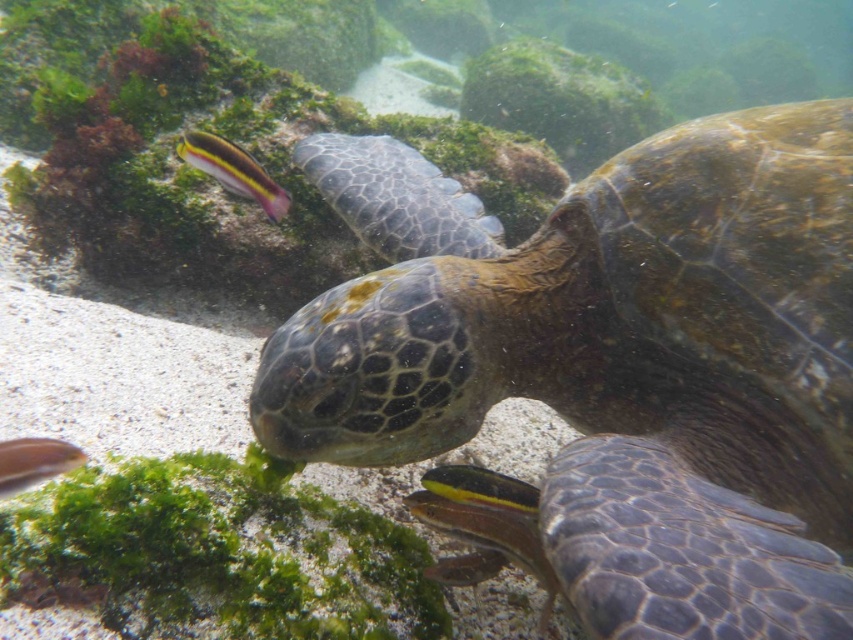
Does yellow-green striped fish at upper left have a greater height compared to shiny silver fish at lower left?

Correct, yellow-green striped fish at upper left is much taller as shiny silver fish at lower left.

Is point (180, 156) farther from viewer compared to point (77, 460)?

Yes, point (180, 156) is farther from viewer.

At what (x,y) coordinates should I click in order to perform the action: click on yellow-green striped fish at upper left. Please return your answer as a coordinate pair (x, y). This screenshot has width=853, height=640. Looking at the image, I should click on (233, 170).

In order to click on yellow-green striped fish at upper left in this screenshot , I will do `click(233, 170)`.

Does leathery green turtle at center appear on the right side of shiny silver fish at lower left?

Indeed, leathery green turtle at center is positioned on the right side of shiny silver fish at lower left.

Is point (602, 550) positioned after point (62, 470)?

That is False.

Between point (604, 461) and point (9, 477), which one is positioned behind?

Positioned behind is point (604, 461).

You are a GUI agent. You are given a task and a screenshot of the screen. Output one action in this format:
    pyautogui.click(x=<x>, y=<y>)
    Task: Click on the leathery green turtle at center
    The width and height of the screenshot is (853, 640).
    Given the screenshot: What is the action you would take?
    pyautogui.click(x=610, y=369)

Between green matte algae at lower left and yellow-green striped fish at upper left, which one is positioned lower?

green matte algae at lower left is lower down.

Does green matte algae at lower left come behind yellow-green striped fish at upper left?

That is False.

Identify the location of green matte algae at lower left. This screenshot has height=640, width=853. (218, 554).